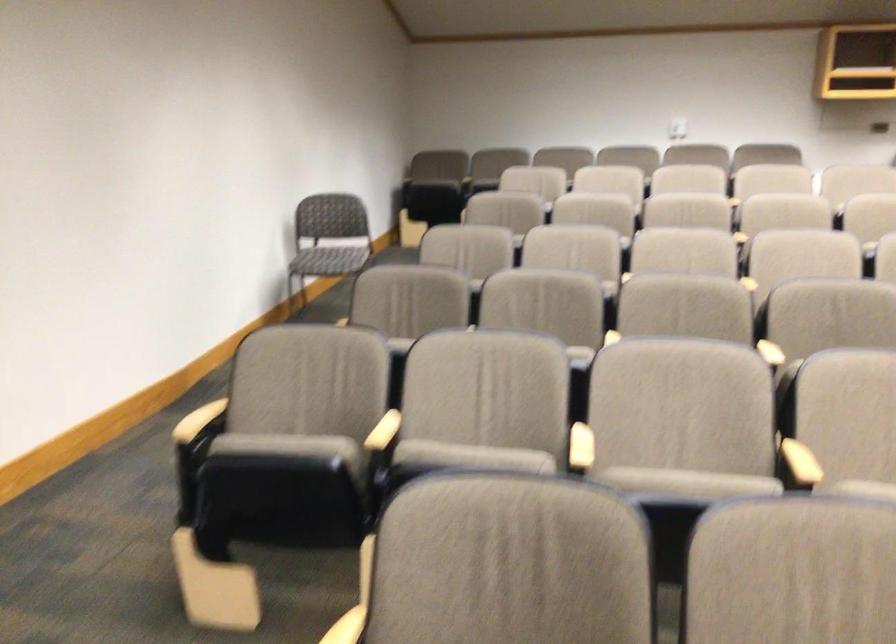
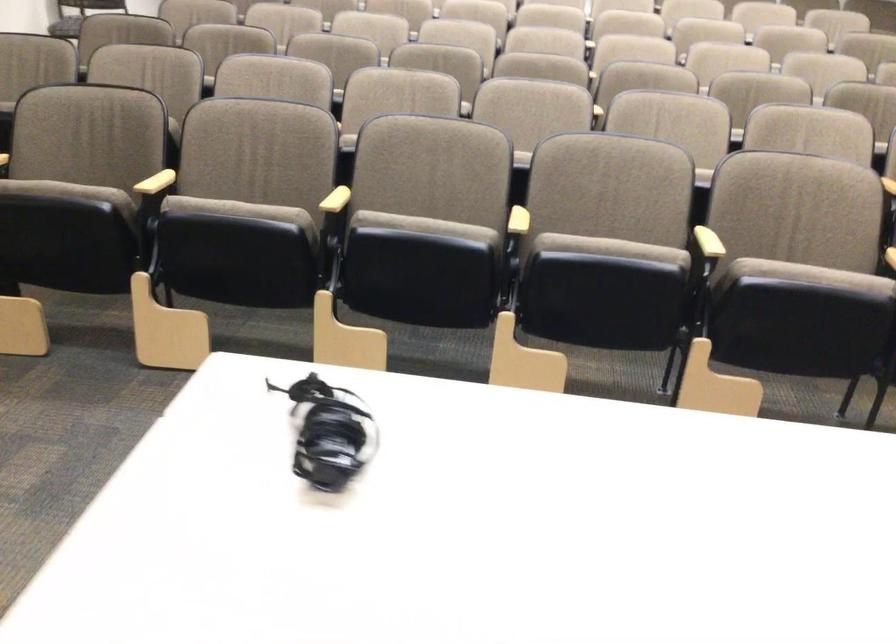
Question: What movement of the cameraman would produce the second image?

Choices:
 (A) Left
 (B) Right
 (C) Forward
 (D) Backward

Answer: (D)